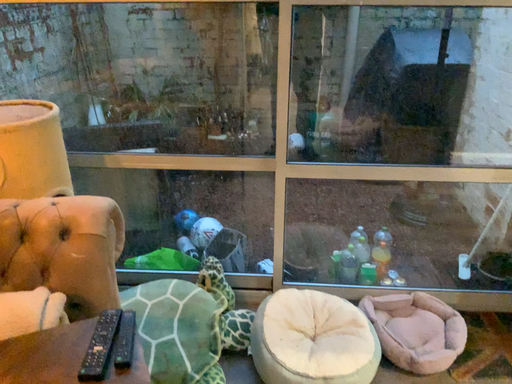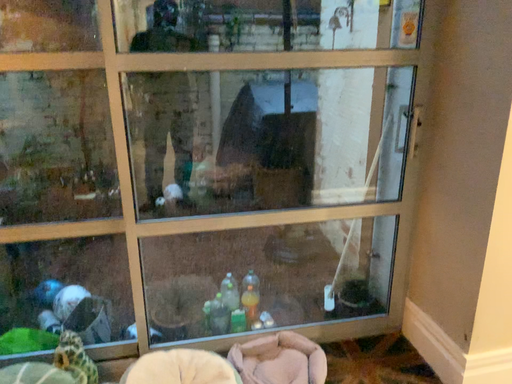
Question: Which way did the camera rotate in the video?

Choices:
 (A) rotated right
 (B) rotated left

Answer: (A)